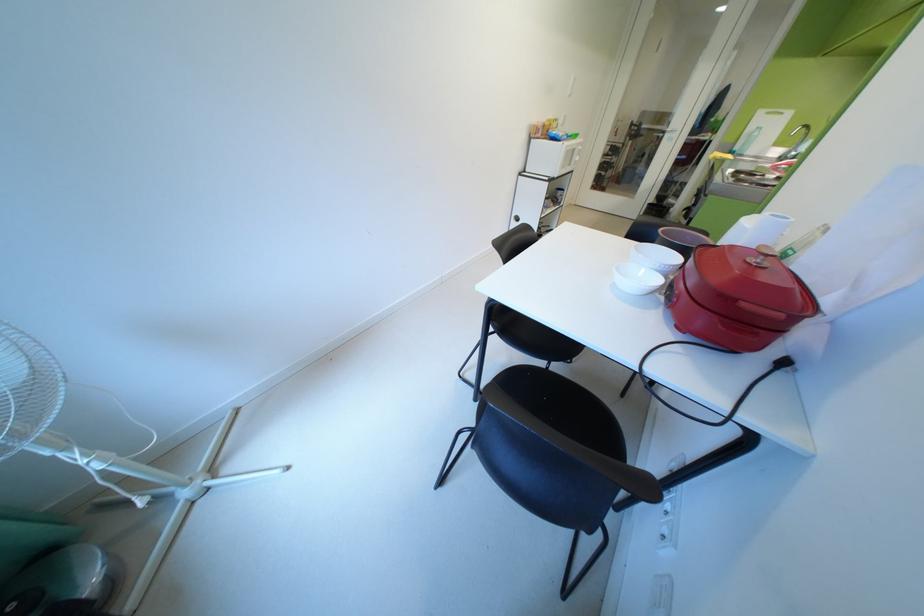
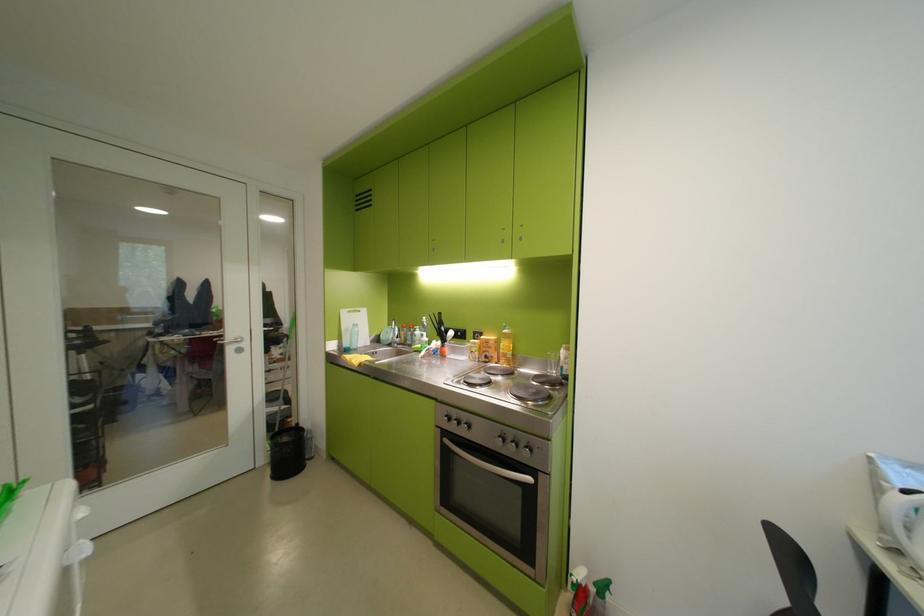
Locate, in the second image, the point that corresponds to the point at 675,132 in the first image.

(233, 346)